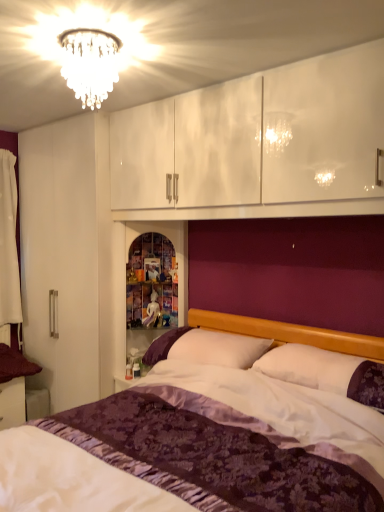
Question: Can you confirm if purple satin bed at center is taller than white soft pillow at center?

Choices:
 (A) no
 (B) yes

Answer: (B)

Question: Is purple satin bed at center smaller than white soft pillow at center?

Choices:
 (A) yes
 (B) no

Answer: (B)

Question: Would you say purple satin bed at center is outside white soft pillow at center?

Choices:
 (A) yes
 (B) no

Answer: (A)

Question: Can you confirm if purple satin bed at center is bigger than white soft pillow at center?

Choices:
 (A) yes
 (B) no

Answer: (A)

Question: Considering the relative positions of purple satin bed at center and white soft pillow at center in the image provided, is purple satin bed at center to the right of white soft pillow at center from the viewer's perspective?

Choices:
 (A) no
 (B) yes

Answer: (A)

Question: From the image's perspective, does purple satin bed at center appear lower than white soft pillow at center?

Choices:
 (A) yes
 (B) no

Answer: (A)

Question: From the image's perspective, would you say white soft pillow at center is shown under white fabric curtain at left?

Choices:
 (A) yes
 (B) no

Answer: (A)

Question: Does white soft pillow at center have a larger size compared to white fabric curtain at left?

Choices:
 (A) yes
 (B) no

Answer: (A)

Question: Is white soft pillow at center to the left of white fabric curtain at left from the viewer's perspective?

Choices:
 (A) no
 (B) yes

Answer: (A)

Question: Is white soft pillow at center outside white fabric curtain at left?

Choices:
 (A) yes
 (B) no

Answer: (A)

Question: From a real-world perspective, is white soft pillow at center positioned under white fabric curtain at left based on gravity?

Choices:
 (A) yes
 (B) no

Answer: (A)

Question: Is white soft pillow at center closer to the viewer compared to white fabric curtain at left?

Choices:
 (A) yes
 (B) no

Answer: (A)

Question: Does crystal chandelier at upper center have a larger size compared to white soft pillow at center?

Choices:
 (A) no
 (B) yes

Answer: (A)